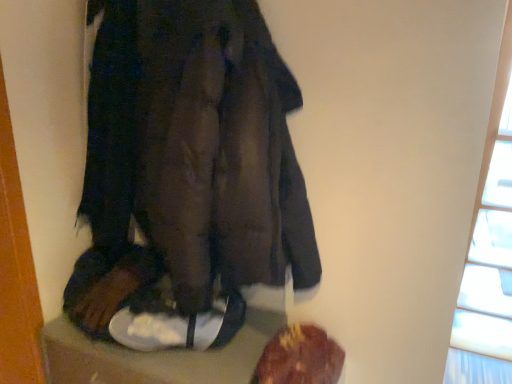
Question: From the image's perspective, is transparent glass window at upper right over dark brown leather coat at center?

Choices:
 (A) no
 (B) yes

Answer: (A)

Question: Is transparent glass window at upper right far away from dark brown leather coat at center?

Choices:
 (A) yes
 (B) no

Answer: (A)

Question: From a real-world perspective, is transparent glass window at upper right physically above dark brown leather coat at center?

Choices:
 (A) no
 (B) yes

Answer: (A)

Question: Can you confirm if transparent glass window at upper right is wider than dark brown leather coat at center?

Choices:
 (A) no
 (B) yes

Answer: (B)

Question: From a real-world perspective, is transparent glass window at upper right beneath dark brown leather coat at center?

Choices:
 (A) yes
 (B) no

Answer: (A)

Question: From the image's perspective, would you say transparent glass window at upper right is shown under dark brown leather coat at center?

Choices:
 (A) no
 (B) yes

Answer: (B)

Question: Is the position of dark brown leather coat at center less distant than that of brown crumbly bread at lower right?

Choices:
 (A) yes
 (B) no

Answer: (A)

Question: Could you tell me if dark brown leather coat at center is facing brown crumbly bread at lower right?

Choices:
 (A) no
 (B) yes

Answer: (A)

Question: Is dark brown leather coat at center to the right of brown crumbly bread at lower right from the viewer's perspective?

Choices:
 (A) no
 (B) yes

Answer: (A)

Question: From a real-world perspective, is dark brown leather coat at center located beneath brown crumbly bread at lower right?

Choices:
 (A) no
 (B) yes

Answer: (A)

Question: Is brown crumbly bread at lower right located within dark brown leather coat at center?

Choices:
 (A) yes
 (B) no

Answer: (B)

Question: From the image's perspective, is dark brown leather coat at center below brown crumbly bread at lower right?

Choices:
 (A) no
 (B) yes

Answer: (A)

Question: Could you tell me if transparent glass window at upper right is turned towards brown crumbly bread at lower right?

Choices:
 (A) yes
 (B) no

Answer: (B)